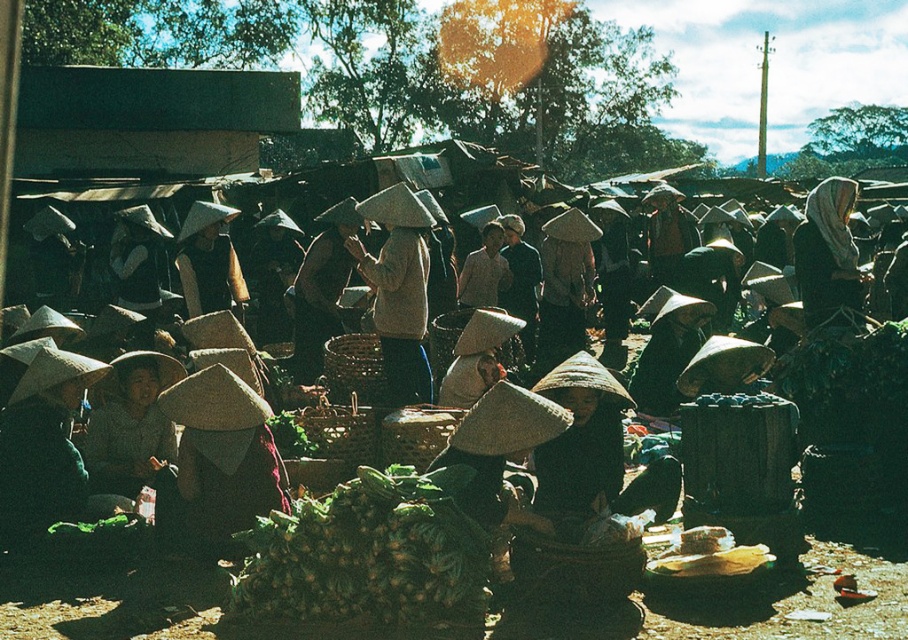
Question: Which of these objects is positioned farthest from the light beige fabric headscarf at center?

Choices:
 (A) matte beige hat at center
 (B) green leafy vegetables at center

Answer: (B)

Question: Where is green leafy vegetables at center located in relation to matte beige hat at center in the image?

Choices:
 (A) above
 (B) below

Answer: (B)

Question: Which of the following is the closest to the observer?

Choices:
 (A) matte beige hat at center
 (B) green leafy vegetables at center
 (C) light beige fabric headscarf at center

Answer: (B)

Question: Does green leafy vegetables at center appear under light beige fabric headscarf at center?

Choices:
 (A) yes
 (B) no

Answer: (A)

Question: Is green leafy vegetables at center wider than light beige fabric headscarf at center?

Choices:
 (A) no
 (B) yes

Answer: (A)

Question: Which point appears farthest from the camera in this image?

Choices:
 (A) (415, 346)
 (B) (353, 529)

Answer: (A)